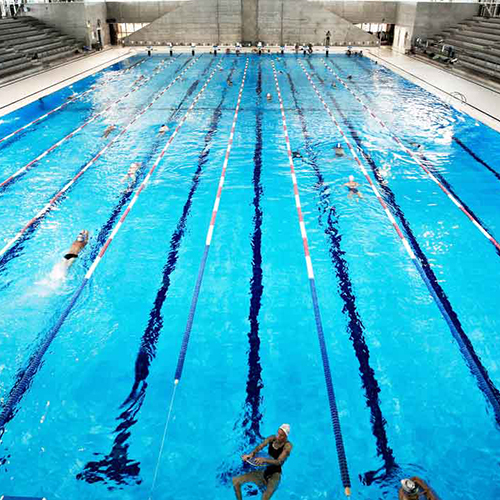
Where is `stairs`? The image size is (500, 500). stairs is located at coordinates (x=54, y=43).